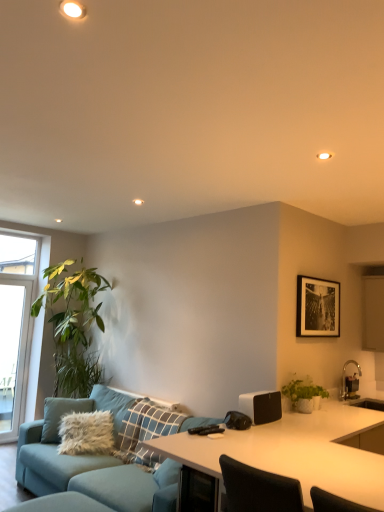
Question: Is transparent glass window at left bigger or smaller than white matte speaker at right?

Choices:
 (A) big
 (B) small

Answer: (A)

Question: In the image, is transparent glass window at left positioned in front of or behind white matte speaker at right?

Choices:
 (A) front
 (B) behind

Answer: (B)

Question: Which object is positioned farthest from the white matte speaker at right?

Choices:
 (A) transparent glass window at left
 (B) green matte plant at right
 (C) teal fabric couch at center
 (D) black matte picture frame at upper right
 (E) light blue fabric swivel chair at lower left

Answer: (A)

Question: Estimate the real-world distances between objects in this image. Which object is closer to the white glossy desk at center?

Choices:
 (A) white matte speaker at right
 (B) transparent glass window at left
 (C) light blue fabric swivel chair at lower left
 (D) green matte plant at right
 (E) black matte picture frame at upper right

Answer: (A)